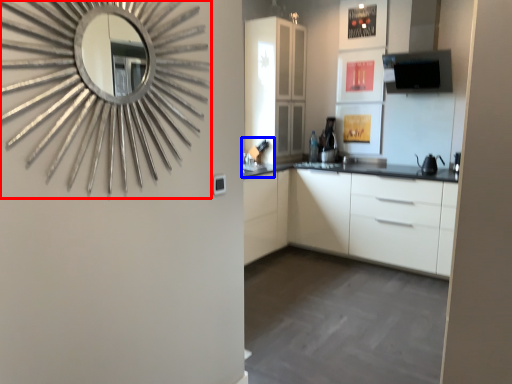
Question: Which object appears closest to the camera in this image, mirror (highlighted by a red box) or sink (highlighted by a blue box)?

Choices:
 (A) mirror
 (B) sink

Answer: (A)